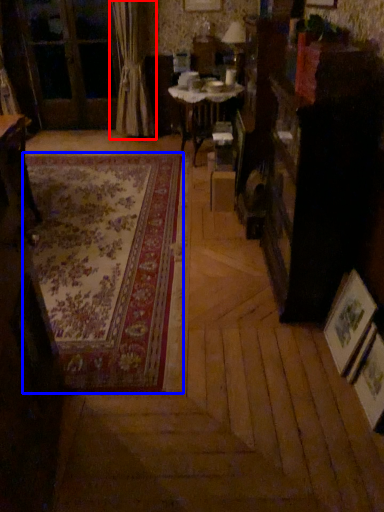
Question: Which object is closer to the camera taking this photo, curtain (highlighted by a red box) or mat (highlighted by a blue box)?

Choices:
 (A) curtain
 (B) mat

Answer: (B)